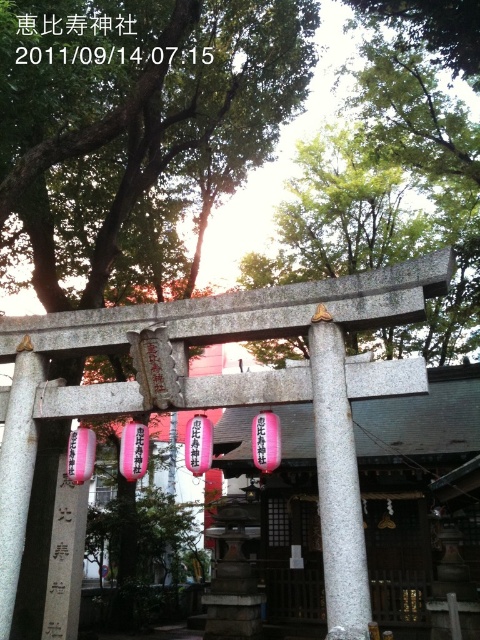
Is gray granite pole at center bigger than black stone sign at center?

Yes.

Is point (336, 608) more distant than point (158, 362)?

No, (336, 608) is in front of (158, 362).

This screenshot has width=480, height=640. What are the coordinates of `gray granite pole at center` in the screenshot? It's located at (337, 484).

Is gray granite pole at center further to camera compared to black paper at upper center?

No, gray granite pole at center is in front of black paper at upper center.

Where is `gray granite pole at center`? gray granite pole at center is located at coordinates (x=337, y=484).

Locate an element on the screen. This screenshot has height=640, width=480. gray granite pole at center is located at coordinates (337, 484).

Does point (56, 42) lie in front of point (158, 396)?

That is False.

Is black paper at upper center closer to camera compared to black stone sign at center?

Yes.

Who is more distant from viewer, [91,60] or [160,355]?

The point [91,60] is behind.

Locate an element on the screen. black paper at upper center is located at coordinates (81, 42).